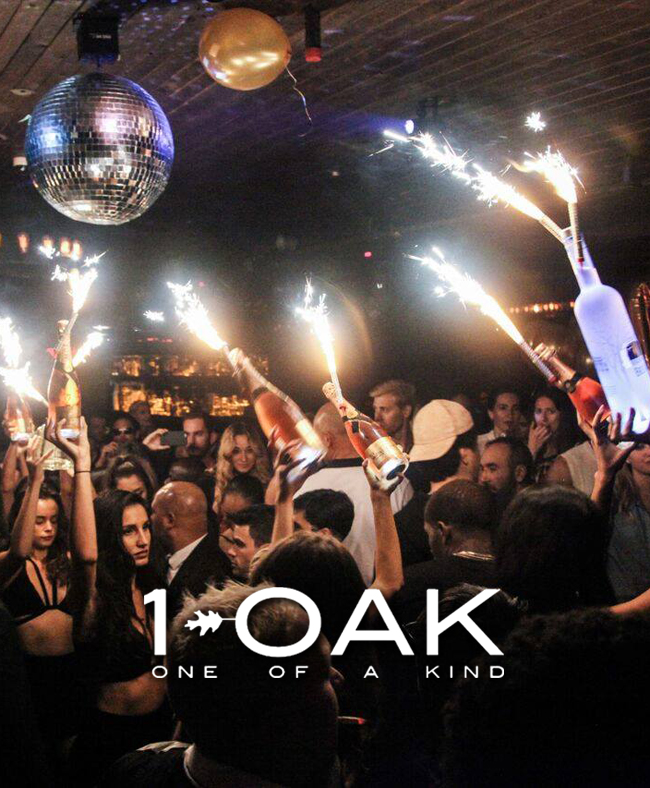
What are the coordinates of `disco ball` in the screenshot? It's located at (103, 187).